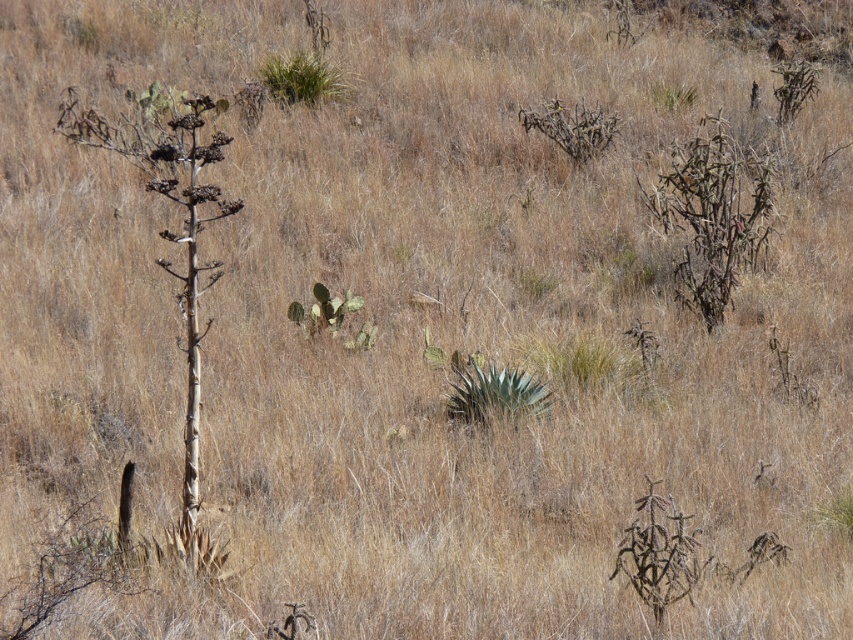
Question: Among these objects, which one is nearest to the camera?

Choices:
 (A) green leafy plant at upper center
 (B) green leafy plant at center

Answer: (B)

Question: Does green leafy plant at center appear under green leafy plant at upper center?

Choices:
 (A) yes
 (B) no

Answer: (A)

Question: Which point is closer to the camera?

Choices:
 (A) (329, 68)
 (B) (515, 403)

Answer: (B)

Question: Is green leafy plant at center to the left of green leafy plant at upper center from the viewer's perspective?

Choices:
 (A) yes
 (B) no

Answer: (B)

Question: Does green leafy plant at center have a smaller size compared to green leafy plant at upper center?

Choices:
 (A) no
 (B) yes

Answer: (A)